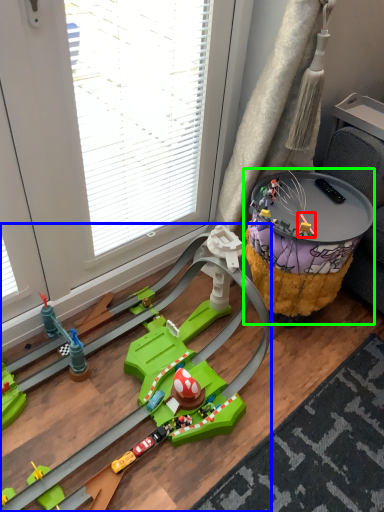
Question: Which is nearer to the toy (highlighted by a red box)? toy (highlighted by a blue box) or table (highlighted by a green box).

Choices:
 (A) toy
 (B) table

Answer: (B)